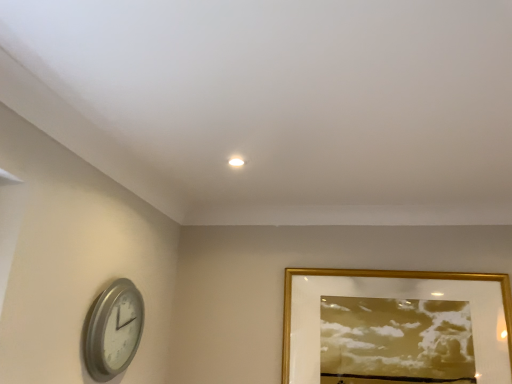
The width and height of the screenshot is (512, 384). What do you see at coordinates (394, 297) in the screenshot?
I see `gold metallic picture frame at upper right` at bounding box center [394, 297].

Where is `gold metallic picture frame at upper right`? gold metallic picture frame at upper right is located at coordinates pos(394,297).

What is the approximate width of gold metallic picture frame at upper right?

1.96 inches.

This screenshot has height=384, width=512. What are the coordinates of `silver metallic clock at lower left` in the screenshot? It's located at (113, 330).

What is the approximate width of silver metallic clock at lower left?

3.00 inches.

Describe the element at coordinates (113, 330) in the screenshot. I see `silver metallic clock at lower left` at that location.

The width and height of the screenshot is (512, 384). I want to click on gold metallic picture frame at upper right, so click(394, 297).

Consider the image. Would you say silver metallic clock at lower left is to the left or to the right of gold metallic picture frame at upper right in the picture?

silver metallic clock at lower left is positioned on gold metallic picture frame at upper right's left side.

Does silver metallic clock at lower left come in front of gold metallic picture frame at upper right?

Yes.

Considering the points (92, 313) and (504, 371), which point is in front, point (92, 313) or point (504, 371)?

Positioned in front is point (92, 313).

From the image's perspective, which object appears higher, silver metallic clock at lower left or gold metallic picture frame at upper right?

silver metallic clock at lower left is shown above in the image.

From a real-world perspective, is silver metallic clock at lower left on top of gold metallic picture frame at upper right?

No, from a real-world perspective, silver metallic clock at lower left is not over gold metallic picture frame at upper right

Considering the sizes of objects silver metallic clock at lower left and gold metallic picture frame at upper right in the image provided, who is wider, silver metallic clock at lower left or gold metallic picture frame at upper right?

With larger width is silver metallic clock at lower left.

Who is shorter, silver metallic clock at lower left or gold metallic picture frame at upper right?

silver metallic clock at lower left is shorter.

Who is smaller, silver metallic clock at lower left or gold metallic picture frame at upper right?

Smaller between the two is silver metallic clock at lower left.

Is silver metallic clock at lower left not inside gold metallic picture frame at upper right?

silver metallic clock at lower left is positioned outside gold metallic picture frame at upper right.

Consider the image. Is silver metallic clock at lower left far from gold metallic picture frame at upper right?

No.

Could you tell me if silver metallic clock at lower left is facing gold metallic picture frame at upper right?

Yes, silver metallic clock at lower left faces towards gold metallic picture frame at upper right.

How distant is silver metallic clock at lower left from gold metallic picture frame at upper right?

A distance of 37.88 inches exists between silver metallic clock at lower left and gold metallic picture frame at upper right.

You are a GUI agent. You are given a task and a screenshot of the screen. Output one action in this format:
    pyautogui.click(x=<x>, y=<y>)
    Task: Click on the picture frame on the right side of silver metallic clock at lower left
    The width and height of the screenshot is (512, 384).
    Given the screenshot: What is the action you would take?
    pyautogui.click(x=394, y=297)

Which is more to the right, gold metallic picture frame at upper right or silver metallic clock at lower left?

gold metallic picture frame at upper right is more to the right.

Is gold metallic picture frame at upper right positioned before silver metallic clock at lower left?

That is False.

Which is behind, point (406, 289) or point (102, 325)?

Point (406, 289)

From the image's perspective, which is below, gold metallic picture frame at upper right or silver metallic clock at lower left?

gold metallic picture frame at upper right appears lower in the image.

Consider the image. From a real-world perspective, is gold metallic picture frame at upper right located higher than silver metallic clock at lower left?

Yes, from a real-world perspective, gold metallic picture frame at upper right is above silver metallic clock at lower left.

Is gold metallic picture frame at upper right wider than silver metallic clock at lower left?

In fact, gold metallic picture frame at upper right might be narrower than silver metallic clock at lower left.

Is gold metallic picture frame at upper right shorter than silver metallic clock at lower left?

Incorrect, the height of gold metallic picture frame at upper right does not fall short of that of silver metallic clock at lower left.

Which of these two, gold metallic picture frame at upper right or silver metallic clock at lower left, is bigger?

gold metallic picture frame at upper right.

Consider the image. Is gold metallic picture frame at upper right completely or partially outside of silver metallic clock at lower left?

gold metallic picture frame at upper right is positioned outside silver metallic clock at lower left.

Can you see gold metallic picture frame at upper right touching silver metallic clock at lower left?

gold metallic picture frame at upper right is not next to silver metallic clock at lower left, and they're not touching.

Is gold metallic picture frame at upper right facing away from silver metallic clock at lower left?

No, gold metallic picture frame at upper right is not facing the opposite direction of silver metallic clock at lower left.

At what (x,y) coordinates should I click in order to perform the action: click on wall clock lying in front of the gold metallic picture frame at upper right. Please return your answer as a coordinate pair (x, y). The image size is (512, 384). Looking at the image, I should click on point(113,330).

At what (x,y) coordinates should I click in order to perform the action: click on wall clock in front of the gold metallic picture frame at upper right. Please return your answer as a coordinate pair (x, y). The image size is (512, 384). Looking at the image, I should click on (113, 330).

The height and width of the screenshot is (384, 512). In order to click on picture frame located below the silver metallic clock at lower left (from the image's perspective) in this screenshot , I will do `click(394, 297)`.